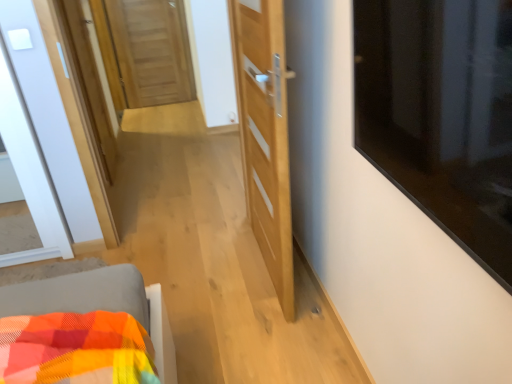
Question: Is the depth of light wood door at center, which is the first door from right to left, greater than that of transparent glass window at upper right?

Choices:
 (A) yes
 (B) no

Answer: (A)

Question: Is light wood door at center, which appears as the 2th door when viewed from the back, wider than transparent glass window at upper right?

Choices:
 (A) yes
 (B) no

Answer: (B)

Question: Are light wood door at center, which is the first door from right to left, and transparent glass window at upper right far apart?

Choices:
 (A) yes
 (B) no

Answer: (B)

Question: Considering the relative positions of light wood door at center, which is the first door from right to left, and transparent glass window at upper right in the image provided, is light wood door at center, which is the first door from right to left, in front of transparent glass window at upper right?

Choices:
 (A) yes
 (B) no

Answer: (B)

Question: Is light wood door at center, arranged as the first door when ordered from the bottom, completely or partially outside of transparent glass window at upper right?

Choices:
 (A) no
 (B) yes

Answer: (B)

Question: From a real-world perspective, does light wood door at center, which appears as the 2th door when viewed from the back, stand above transparent glass window at upper right?

Choices:
 (A) no
 (B) yes

Answer: (A)

Question: From the image's perspective, is transparent glass window at upper right under light wood door at center, which is the first door from right to left?

Choices:
 (A) yes
 (B) no

Answer: (A)

Question: Is transparent glass window at upper right not inside light wood door at center, which is the first door from right to left?

Choices:
 (A) no
 (B) yes

Answer: (B)

Question: Is transparent glass window at upper right next to light wood door at center, which appears as the 2th door when viewed from the back, and touching it?

Choices:
 (A) yes
 (B) no

Answer: (B)

Question: Does transparent glass window at upper right have a lesser width compared to light wood door at center, the 1th door viewed from the front?

Choices:
 (A) yes
 (B) no

Answer: (B)

Question: Does transparent glass window at upper right come in front of light wood door at center, the 2th door positioned from the left?

Choices:
 (A) yes
 (B) no

Answer: (A)

Question: Can you confirm if transparent glass window at upper right is smaller than light wood door at center, which is the first door from right to left?

Choices:
 (A) no
 (B) yes

Answer: (B)

Question: Considering the relative positions of transparent glass window at upper right and wooden door at center, the second door positioned from the right, in the image provided, is transparent glass window at upper right to the right of wooden door at center, the second door positioned from the right, from the viewer's perspective?

Choices:
 (A) yes
 (B) no

Answer: (A)